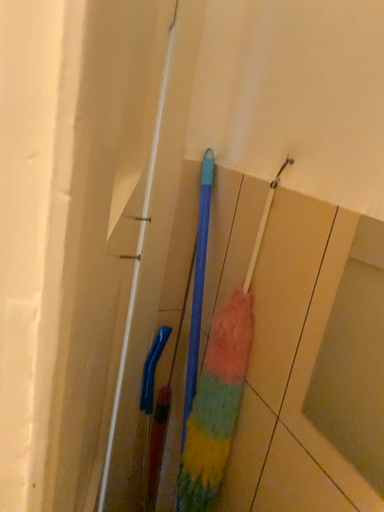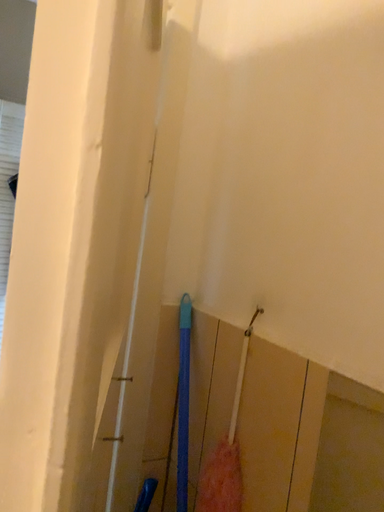
Question: Which way did the camera rotate in the video?

Choices:
 (A) rotated downward
 (B) rotated upward

Answer: (B)